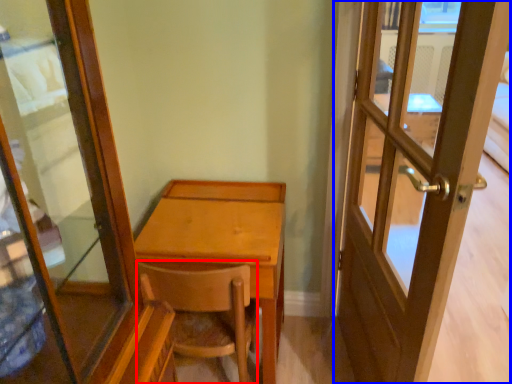
Question: Among these objects, which one is nearest to the camera, chair (highlighted by a red box) or door (highlighted by a blue box)?

Choices:
 (A) chair
 (B) door

Answer: (B)